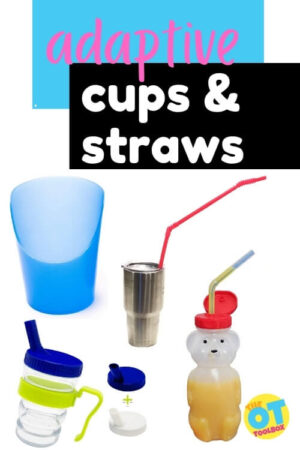
Identify the location of metal cup. (147, 294).